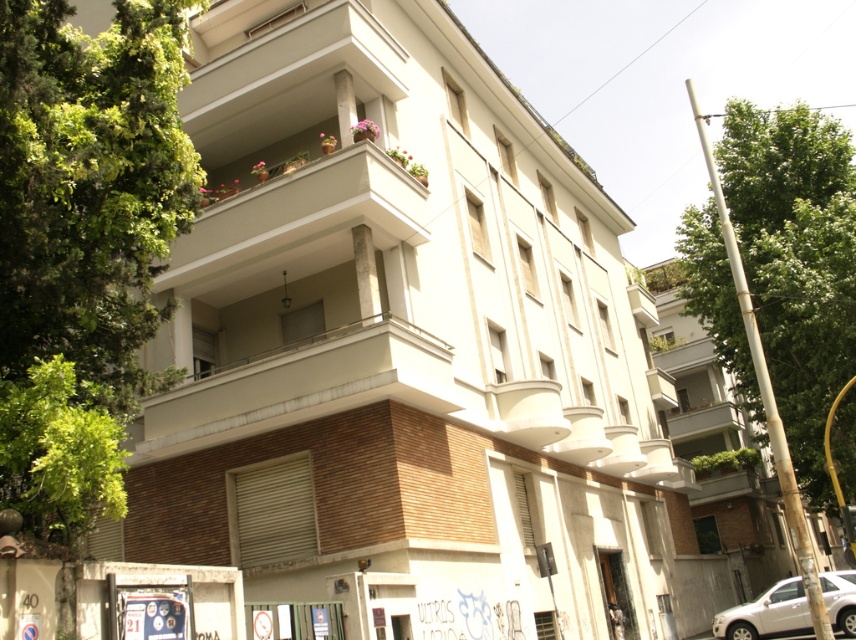
Does green leafy tree at right have a greater height compared to white matte car at lower right?

Yes.

Which is behind, point (852, 452) or point (791, 605)?

The point (852, 452) is more distant.

At what (x,y) coordinates should I click in order to perform the action: click on green leafy tree at right. Please return your answer as a coordinate pair (x, y). Looking at the image, I should click on (795, 262).

Is point (280, 268) behind point (794, 577)?

No, (280, 268) is in front of (794, 577).

Between white concrete balcony at upper center and white matte car at lower right, which one appears on the left side from the viewer's perspective?

white concrete balcony at upper center is more to the left.

Is point (417, 220) positioned after point (849, 595)?

That is False.

Locate an element on the screen. The width and height of the screenshot is (856, 640). white concrete balcony at upper center is located at coordinates (295, 225).

Can you confirm if green leafy tree at right is positioned to the left of white concrete balcony at upper center?

No, green leafy tree at right is not to the left of white concrete balcony at upper center.

In the scene shown: Which of these two, green leafy tree at right or white concrete balcony at upper center, stands shorter?

white concrete balcony at upper center

Who is more distant from viewer, (x=800, y=404) or (x=288, y=179)?

The point (x=800, y=404) is more distant.

The width and height of the screenshot is (856, 640). In order to click on green leafy tree at right in this screenshot , I will do `click(795, 262)`.